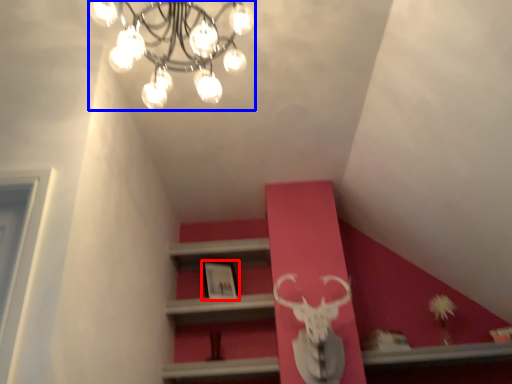
Question: Among these objects, which one is farthest to the camera, picture frame (highlighted by a red box) or lamp (highlighted by a blue box)?

Choices:
 (A) picture frame
 (B) lamp

Answer: (A)